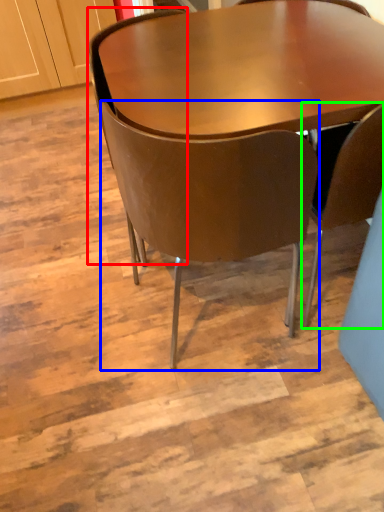
Question: Based on their relative distances, which object is nearer to chair (highlighted by a red box)? Choose from chair (highlighted by a blue box) and chair (highlighted by a green box).

Choices:
 (A) chair
 (B) chair

Answer: (A)